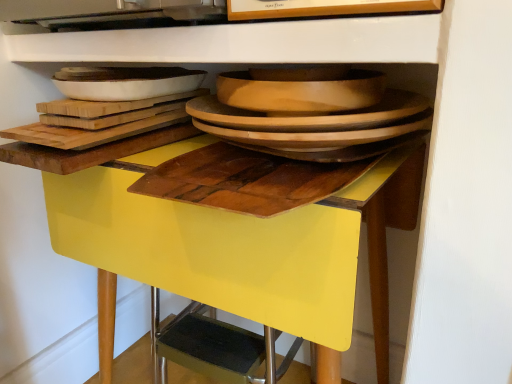
Question: Is wooden cutting board at center not close to white glossy platter at upper left, acting as the first platter starting from the left?

Choices:
 (A) no
 (B) yes

Answer: (A)

Question: Considering the relative sizes of wooden cutting board at center and white glossy platter at upper left, acting as the first platter starting from the left, in the image provided, is wooden cutting board at center wider than white glossy platter at upper left, acting as the first platter starting from the left,?

Choices:
 (A) yes
 (B) no

Answer: (A)

Question: Can you confirm if wooden cutting board at center is bigger than white glossy platter at upper left, acting as the first platter starting from the left?

Choices:
 (A) yes
 (B) no

Answer: (B)

Question: Is wooden cutting board at center at the right side of white glossy platter at upper left, which is the 2th platter from right to left?

Choices:
 (A) no
 (B) yes

Answer: (B)

Question: From a real-world perspective, is wooden cutting board at center located beneath white glossy platter at upper left, which is the 2th platter from right to left?

Choices:
 (A) no
 (B) yes

Answer: (B)

Question: Does wooden cutting board at center have a lesser height compared to white glossy platter at upper left, which is the 2th platter from right to left?

Choices:
 (A) no
 (B) yes

Answer: (B)

Question: Considering the relative sizes of wooden platter at center, the second platter in the left-to-right sequence, and wooden cutting board at center in the image provided, is wooden platter at center, the second platter in the left-to-right sequence, thinner than wooden cutting board at center?

Choices:
 (A) no
 (B) yes

Answer: (B)

Question: Does wooden platter at center, acting as the 1th platter starting from the right, have a lesser height compared to wooden cutting board at center?

Choices:
 (A) yes
 (B) no

Answer: (B)

Question: From a real-world perspective, is wooden platter at center, acting as the 1th platter starting from the right, located beneath wooden cutting board at center?

Choices:
 (A) yes
 (B) no

Answer: (B)

Question: Can you confirm if wooden platter at center, the second platter in the left-to-right sequence, is taller than wooden cutting board at center?

Choices:
 (A) no
 (B) yes

Answer: (B)

Question: Is wooden platter at center, the second platter in the left-to-right sequence, next to wooden cutting board at center and touching it?

Choices:
 (A) yes
 (B) no

Answer: (B)

Question: Would you say wooden platter at center, acting as the 1th platter starting from the right, contains wooden cutting board at center?

Choices:
 (A) no
 (B) yes

Answer: (A)

Question: Does yellow glossy table at center have a larger size compared to white glossy platter at upper left, which is the 2th platter from right to left?

Choices:
 (A) yes
 (B) no

Answer: (A)